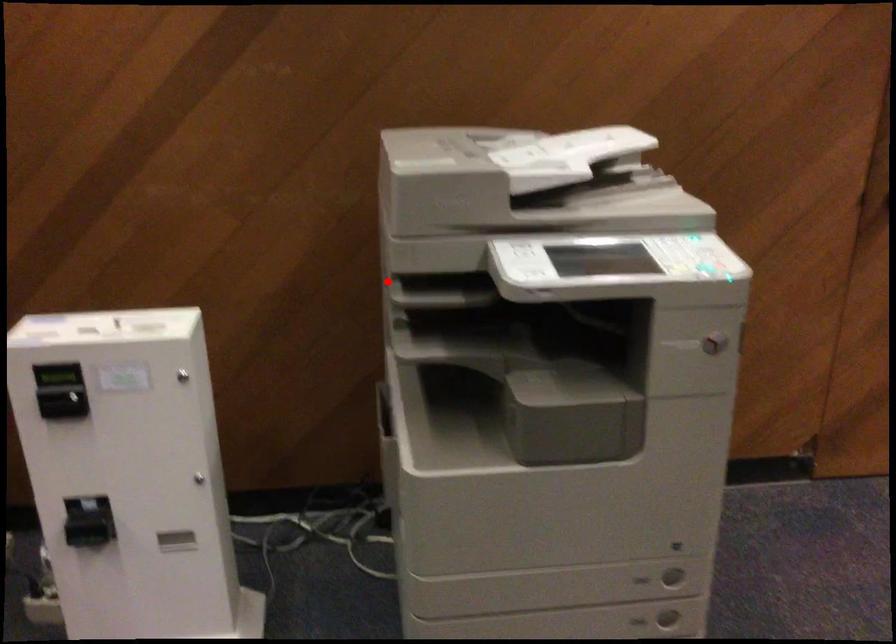
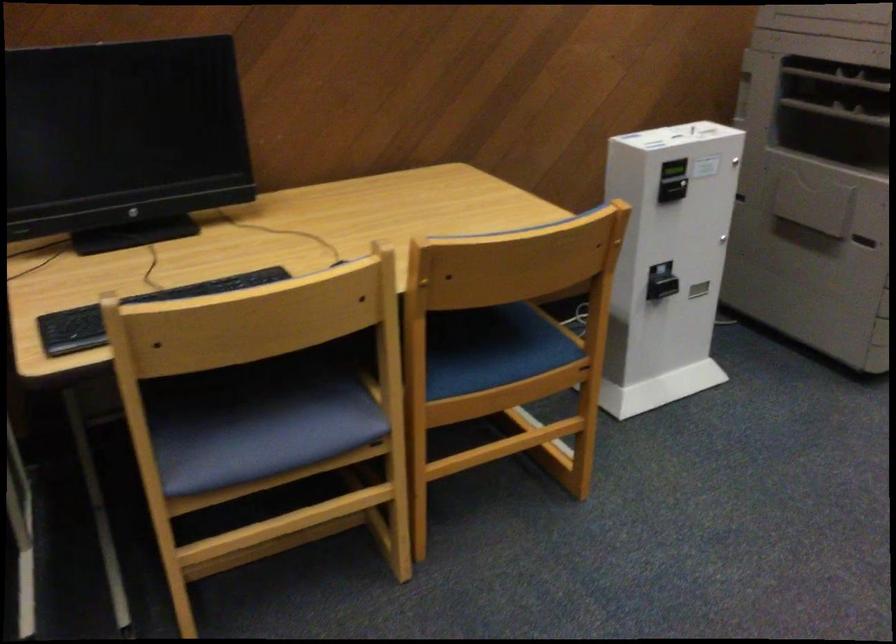
The point at the highlighted location is marked in the first image. Where is the corresponding point in the second image?

(839, 79)